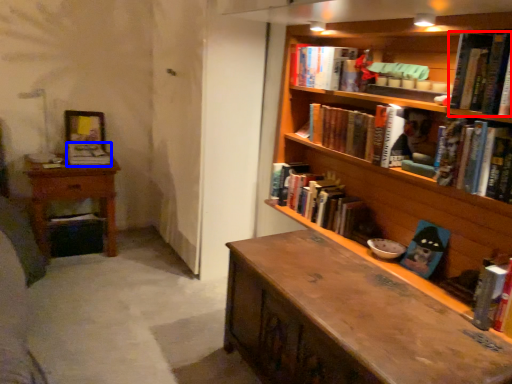
Question: Which of the following is the farthest to the observer, book (highlighted by a red box) or book (highlighted by a blue box)?

Choices:
 (A) book
 (B) book

Answer: (B)